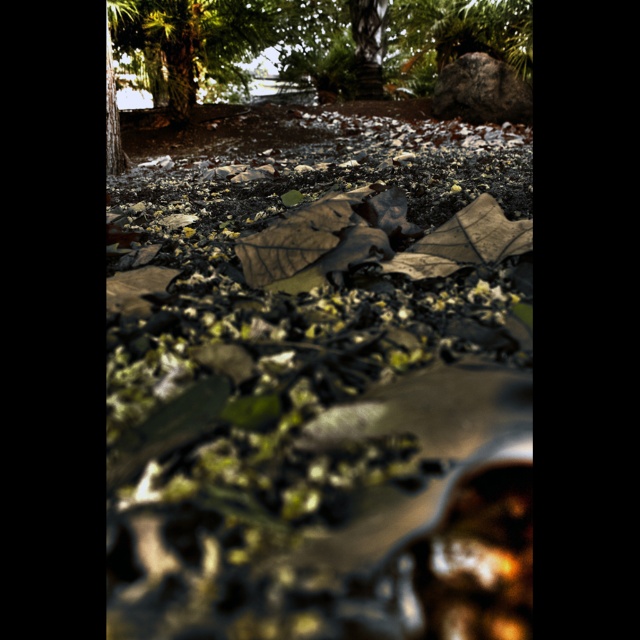
Question: Observing the image, what is the correct spatial positioning of green leafy tree at upper left in reference to rough gray rock at upper right?

Choices:
 (A) left
 (B) right

Answer: (A)

Question: Does brown leaf litter at center appear under green leafy tree at upper left?

Choices:
 (A) no
 (B) yes

Answer: (B)

Question: Estimate the real-world distances between objects in this image. Which object is closer to the green leafy tree at upper left?

Choices:
 (A) brown leaf litter at center
 (B) rough gray rock at upper right

Answer: (B)

Question: Which point is farther from the camera taking this photo?

Choices:
 (A) (177, 88)
 (B) (449, 93)
 (C) (182, 186)

Answer: (B)

Question: Which point appears farthest from the camera in this image?

Choices:
 (A) (452, 65)
 (B) (333, 316)

Answer: (A)

Question: Is brown leaf litter at center thinner than green leafy tree at upper left?

Choices:
 (A) yes
 (B) no

Answer: (A)